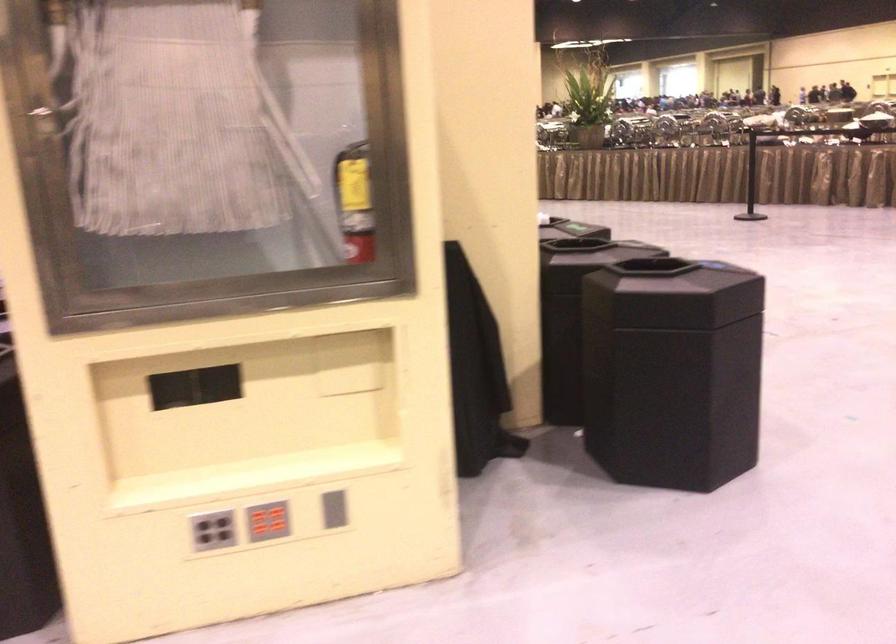
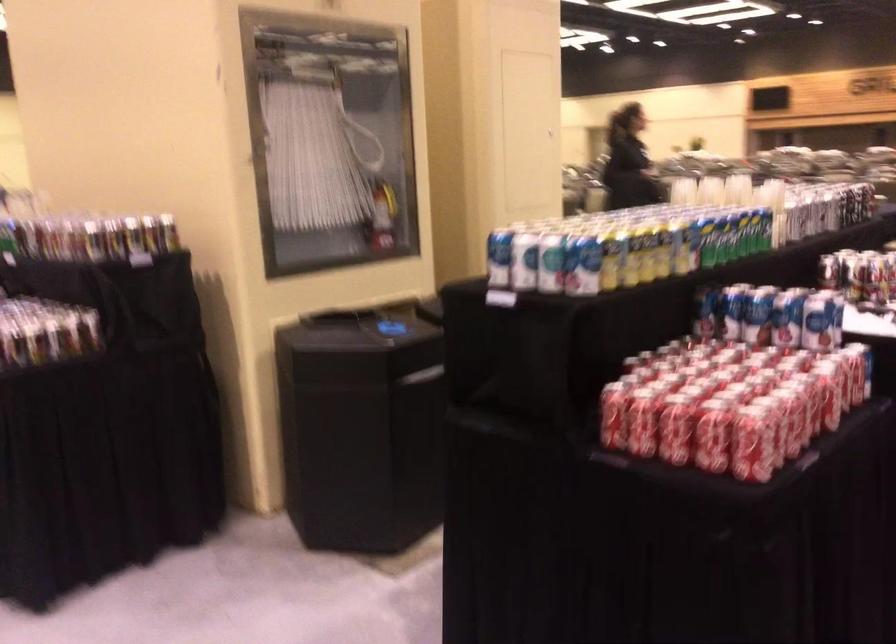
Question: I am providing you with two images of the same scene from different viewpoints. After the viewpoint changes to image2, which objects are now occluded?

Choices:
 (A) small brass knob
 (B) grey button panel
 (C) red soda can
 (D) blue and white can

Answer: (B)